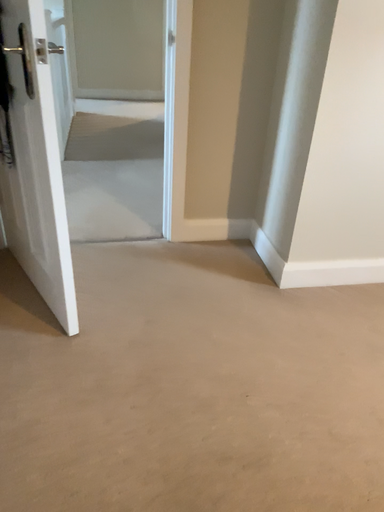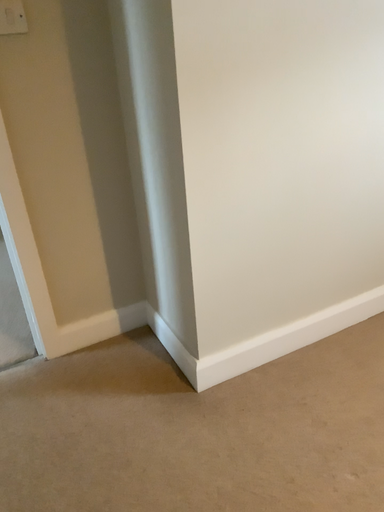
Question: Which way did the camera rotate in the video?

Choices:
 (A) rotated right
 (B) rotated left

Answer: (A)